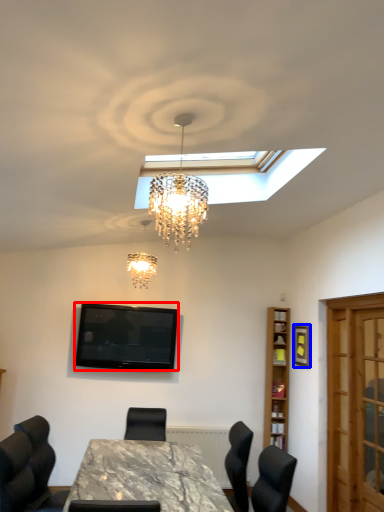
Question: Which object appears closest to the camera in this image, television (highlighted by a red box) or picture frame (highlighted by a blue box)?

Choices:
 (A) television
 (B) picture frame

Answer: (B)